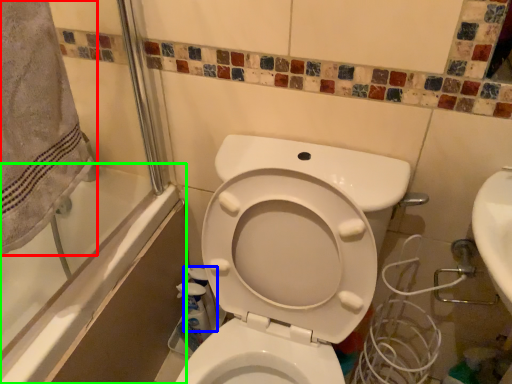
Question: Which object is positioned closest to bath towel (highlighted by a red box)? Select from cleaning product (highlighted by a blue box) and bath (highlighted by a green box).

Choices:
 (A) cleaning product
 (B) bath

Answer: (B)